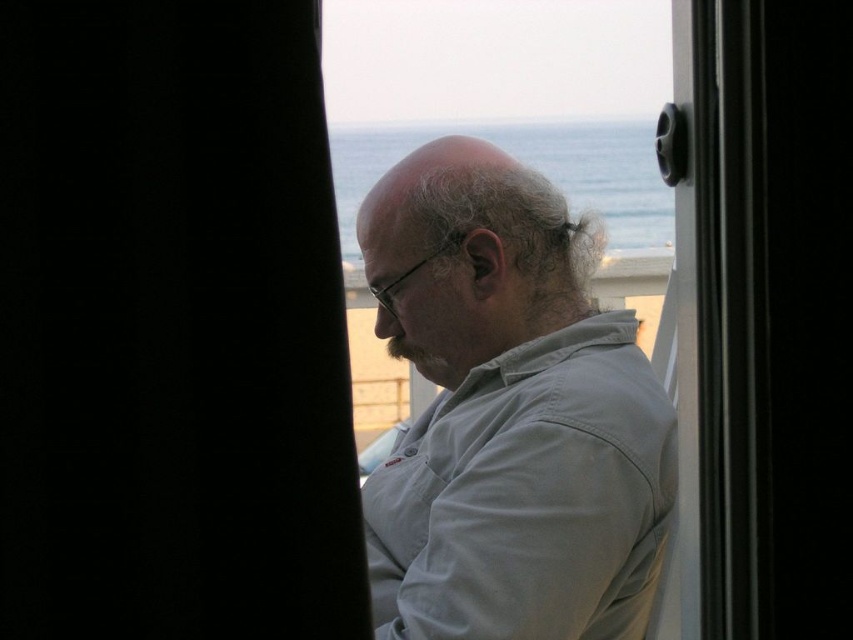
You are a photographer trying to capture the man in the gray cotton shirt at center without including the black fabric curtain at left in the frame. Based on their spatial relationship, is this possible?

The black fabric curtain at left occupies less space than gray cotton shirt at center, so it is possible to frame the shot to exclude the curtain while including the shirt.

The man in the image is trying to decide whether to hang a small painting between the black fabric curtain at left and the window frame. The painting is 45 centimeters wide. Can he fit it there?

The black fabric curtain at left and the window frame are 93.03 centimeters apart. Since the painting is 45 centimeters wide, which is less than the space between them, the man can fit the painting there.

You are standing in the room where the man is seated. You want to find the point at coordinates point (171, 326). Where would you look?

The point (171, 326) is on the black fabric curtain at left.